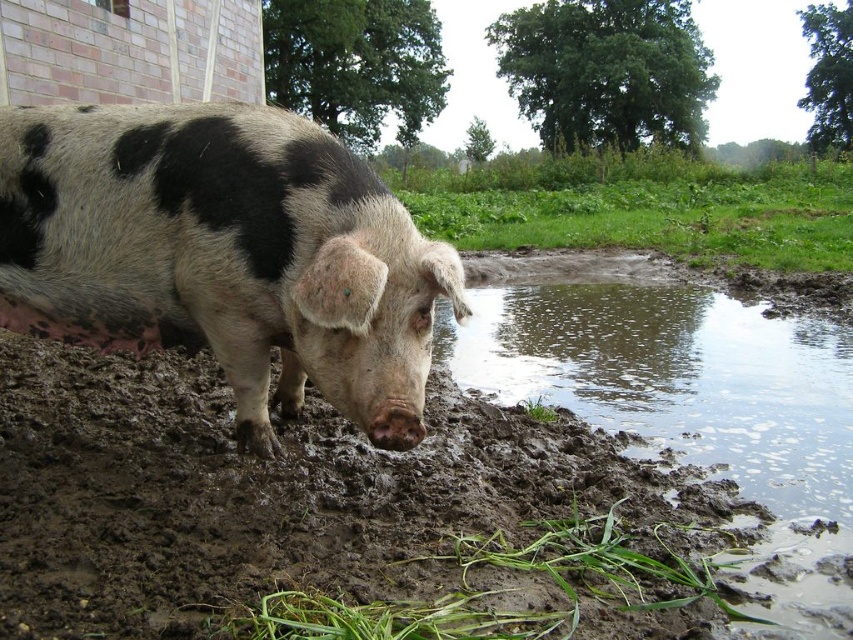
Question: Does brown wet mud at lower center appear under green grass at center?

Choices:
 (A) no
 (B) yes

Answer: (B)

Question: Which of the following is the farthest from the observer?

Choices:
 (A) green grassy mud at lower center
 (B) brown wet mud at lower center
 (C) speckled fur pig at lower left
 (D) green grass at center

Answer: (D)

Question: Can you confirm if speckled fur pig at lower left is smaller than muddy water at lower right?

Choices:
 (A) yes
 (B) no

Answer: (A)

Question: Which point is closer to the camera?

Choices:
 (A) speckled fur pig at lower left
 (B) green grass at center

Answer: (A)

Question: Which point is closer to the camera taking this photo?

Choices:
 (A) (444, 401)
 (B) (616, 189)
 (C) (810, 355)
 (D) (103, 241)

Answer: (D)

Question: Is brown wet mud at lower center to the left of speckled fur pig at lower left from the viewer's perspective?

Choices:
 (A) no
 (B) yes

Answer: (B)